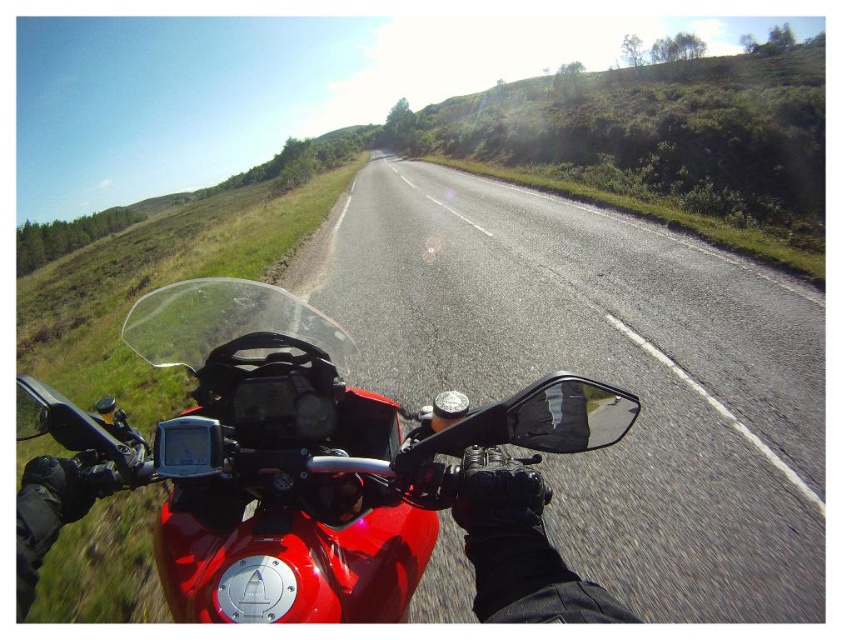
You are riding a motorcycle and looking at the road ahead. You notice two points marked on the road ahead of you. The first point is at coordinates point (649, 396) and the second point is at point (290, 531). Which point is closer to your motorcycle?

Point (290, 531) is closer to your motorcycle because it is less far from the camera than point (649, 396).

You are riding a motorcycle and see the asphalt road at center and the glossy red motorcycle at center. Which object is closer to you?

The asphalt road at center is closer to you because it is positioned over the glossy red motorcycle at center, indicating it is in front of the motorcycle.

From the picture: You are a motorcyclist preparing to make a left turn onto a side street that is 25 inches wide. Based on the distance of the asphalt road at center from the viewer, can you safely navigate the turn without encroaching on the opposite lane?

The asphalt road at center is 31.90 inches from the viewer. Since the side street is 25 inches wide, which is narrower than the current road, you can safely navigate the turn as long as you stay within the 31.90 inches width, avoiding the opposite lane.